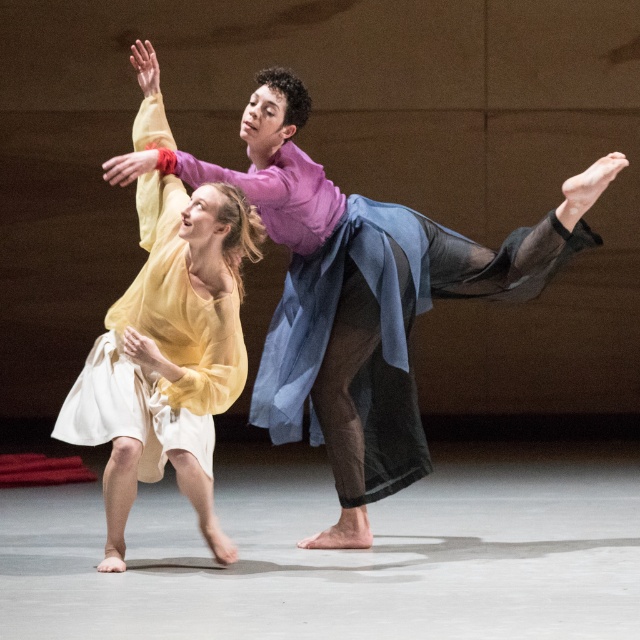
Question: Is matte yellow dress at center bigger than matte yellow dress at left?

Choices:
 (A) yes
 (B) no

Answer: (A)

Question: Which point is farther to the camera?

Choices:
 (A) matte yellow dress at center
 (B) matte yellow dress at left

Answer: (B)

Question: Is matte yellow dress at center bigger than matte yellow dress at left?

Choices:
 (A) no
 (B) yes

Answer: (B)

Question: Among these objects, which one is nearest to the camera?

Choices:
 (A) matte yellow dress at left
 (B) matte yellow dress at center

Answer: (B)

Question: Can you confirm if matte yellow dress at center is positioned below matte yellow dress at left?

Choices:
 (A) no
 (B) yes

Answer: (A)